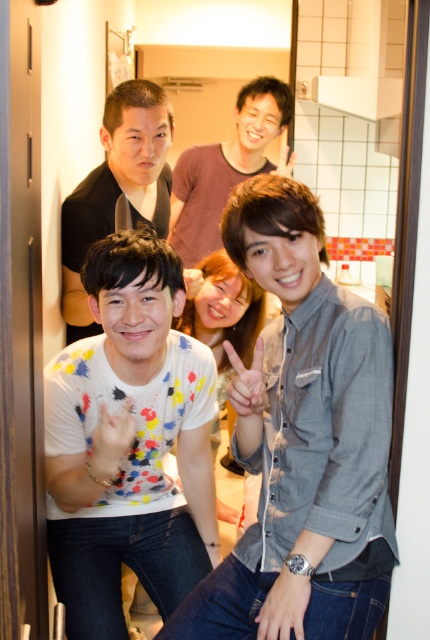
You are a photographer trying to adjust the lighting for a photo shoot in the bathroom. You need to ensure that the gray cotton shirt at center and the black matte shirt at upper center are both well lit. Given their positions, which shirt should you focus the light on first to ensure it doesn

The gray cotton shirt at center is taller than the black matte shirt at upper center, so you should focus the light on the gray cotton shirt at center first to ensure it is properly illuminated before adjusting for the shorter black matte shirt at upper center.

You are a photographer trying to adjust the lighting for a group photo in the bathroom. You notice the black matte shirt at upper center and the matte gray shirt at center. Which shirt should you focus on to ensure proper exposure since it is closer to the camera?

The black matte shirt at upper center has a lesser height compared to the matte gray shirt at center, so it is closer to the camera. Therefore, you should focus on the black matte shirt at upper center to ensure proper exposure.

You are a photographer trying to adjust the lighting in the bathroom scene. You need to place a spotlight to the right of the black matte shirt at upper center and to the left of the matte gray shirt at center. Is there enough space between them to fit the spotlight?

The black matte shirt at upper center is positioned on the left side of matte gray shirt at center, so placing a spotlight between them would require space. However, the description only states their positional relationship without specifying the distance. Without knowing the exact distance, it is uncertain if the spotlight can fit.